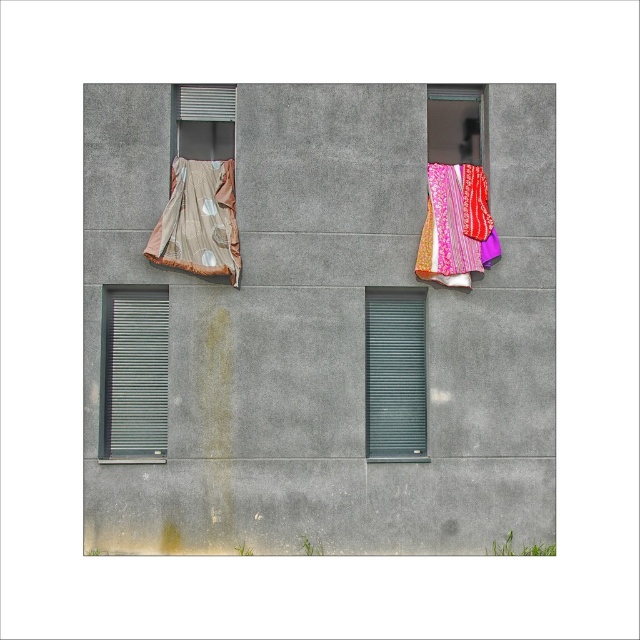
You are a painter standing 20 inches away from the wall. You want to paint both the matte gray shutter at left and the shiny metallic curtain at upper left. Can you reach both objects without moving your ladder?

The matte gray shutter at left is 17.70 inches away from the shiny metallic curtain at upper left. Since you are already 20 inches away from the wall, you can reach both objects without moving your ladder as the distance between them is less than your current distance from the wall.

You are standing in front of the wall and want to hang a new picture. The wall has a textured concrete wall at center and a pink patterned fabric at upper right. Which surface should you choose if you want your picture to be closer to the viewer?

You should choose the textured concrete wall at center because it is in front of the pink patterned fabric at upper right, making it closer to the viewer.